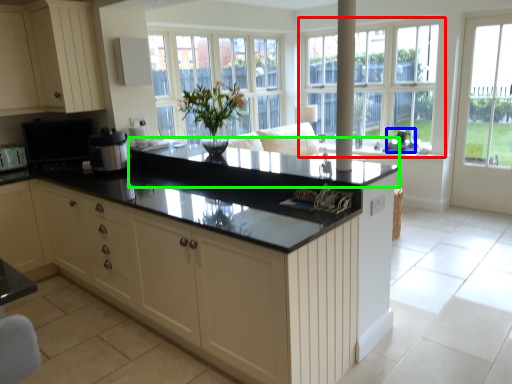
Question: Estimate the real-world distances between objects in this image. Which object is farther from window (highlighted by a red box), appliance (highlighted by a blue box) or countertop (highlighted by a green box)?

Choices:
 (A) appliance
 (B) countertop

Answer: (B)